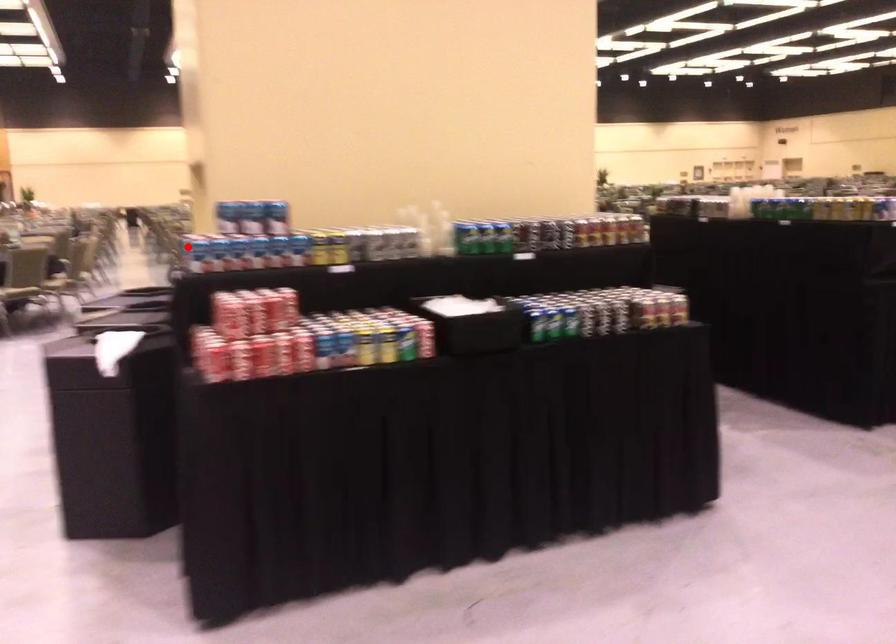
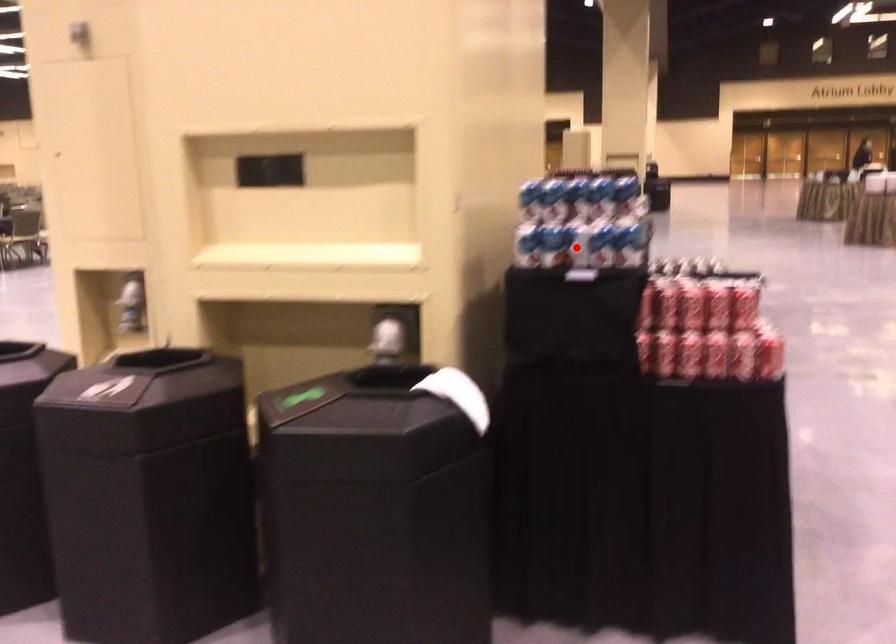
I am providing you with two images of the same scene from different viewpoints. A red point is marked on the first image and another point is marked on the second image. Does the point marked in image1 correspond to the same location as the one in image2?

No